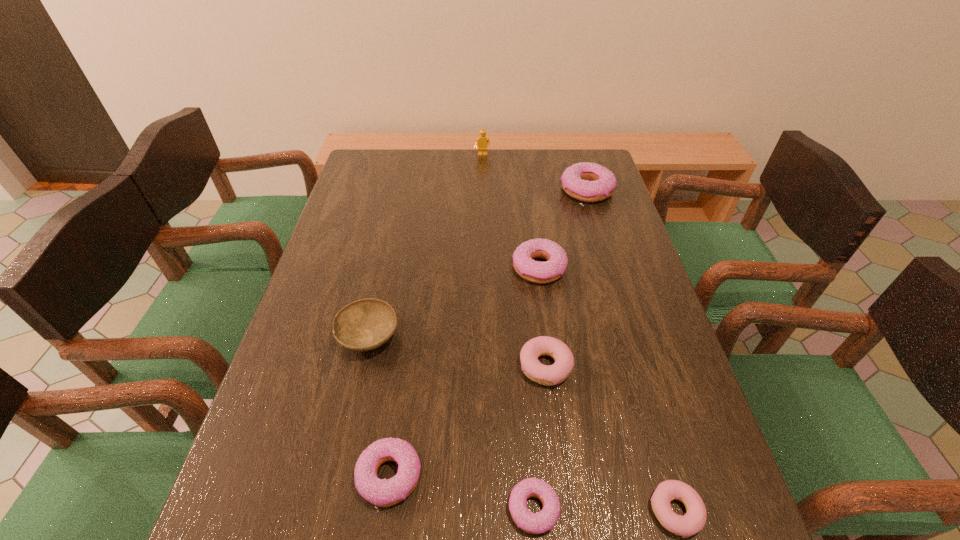
Where is `the leftmost doughnut`? The height and width of the screenshot is (540, 960). the leftmost doughnut is located at coordinates (383, 493).

This screenshot has width=960, height=540. Identify the location of the smaller pink doughnut. (693, 521).

You are a GUI agent. You are given a task and a screenshot of the screen. Output one action in this format:
    pyautogui.click(x=<x>, y=<y>)
    Task: Click on the right pink doughnut
    
    Given the screenshot: What is the action you would take?
    pyautogui.click(x=693, y=521)

Where is `the smallest purple doughnut`? This screenshot has height=540, width=960. the smallest purple doughnut is located at coordinates (535, 523).

Image resolution: width=960 pixels, height=540 pixels. What are the coordinates of `free space located on the face of the third object from left to right` in the screenshot? It's located at (483, 224).

Image resolution: width=960 pixels, height=540 pixels. Identify the location of blank space located on the front of the second tallest object. (612, 269).

Where is `vacant area situated 0.140m on the back of the second farthest doughnut`? The image size is (960, 540). vacant area situated 0.140m on the back of the second farthest doughnut is located at coordinates (533, 220).

At what (x,y) coordinates should I click in order to perform the action: click on free space located on the left of the gray bowl. Please return your answer as a coordinate pair (x, y). This screenshot has height=540, width=960. Looking at the image, I should click on (308, 336).

Identify the location of vacant point located on the back of the fourth nearest doughnut. This screenshot has height=540, width=960. point(540,315).

Where is `free location located on the right of the leftmost purple doughnut`? Image resolution: width=960 pixels, height=540 pixels. free location located on the right of the leftmost purple doughnut is located at coordinates [x=636, y=477].